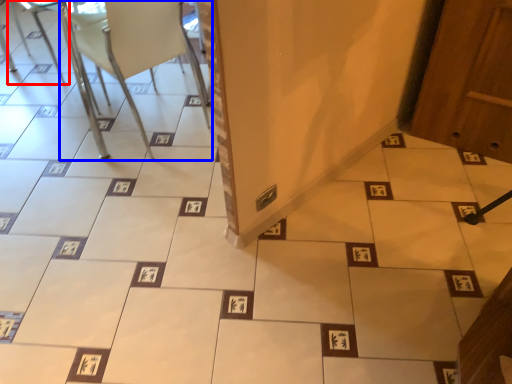
Question: Which of the following is the closest to the observer, armchair (highlighted by a red box) or chair (highlighted by a blue box)?

Choices:
 (A) armchair
 (B) chair

Answer: (B)